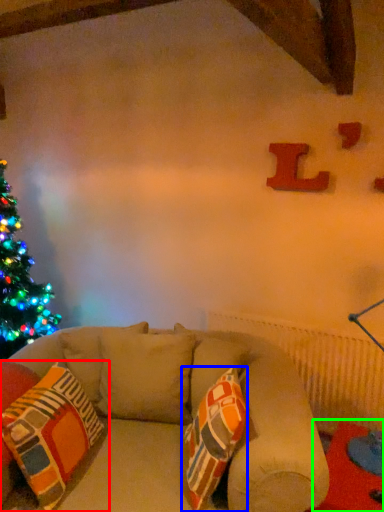
Question: Considering the real-world distances, which object is farthest from pillow (highlighted by a red box)? throw pillow (highlighted by a blue box) or table (highlighted by a green box)?

Choices:
 (A) throw pillow
 (B) table

Answer: (B)